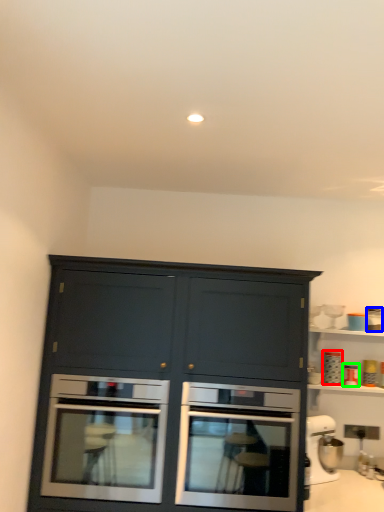
Question: Which object is positioned farthest from appliance (highlighted by a red box)? Select from appliance (highlighted by a blue box) and appliance (highlighted by a green box).

Choices:
 (A) appliance
 (B) appliance

Answer: (A)